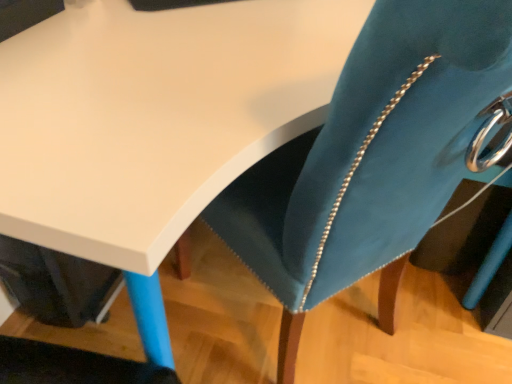
Question: Is velvet teal swivel chair at center taller or shorter than matte white table at upper left?

Choices:
 (A) tall
 (B) short

Answer: (A)

Question: Considering the relative positions of velvet teal swivel chair at center and matte white table at upper left in the image provided, is velvet teal swivel chair at center to the left or to the right of matte white table at upper left?

Choices:
 (A) right
 (B) left

Answer: (A)

Question: Does point (458, 165) appear closer or farther from the camera than point (193, 16)?

Choices:
 (A) farther
 (B) closer

Answer: (B)

Question: Is matte white table at upper left situated inside velvet teal swivel chair at center or outside?

Choices:
 (A) outside
 (B) inside

Answer: (A)

Question: Based on their sizes in the image, would you say matte white table at upper left is bigger or smaller than velvet teal swivel chair at center?

Choices:
 (A) big
 (B) small

Answer: (A)

Question: Is matte white table at upper left taller or shorter than velvet teal swivel chair at center?

Choices:
 (A) tall
 (B) short

Answer: (B)

Question: Looking at their shapes, would you say matte white table at upper left is wider or thinner than velvet teal swivel chair at center?

Choices:
 (A) thin
 (B) wide

Answer: (B)